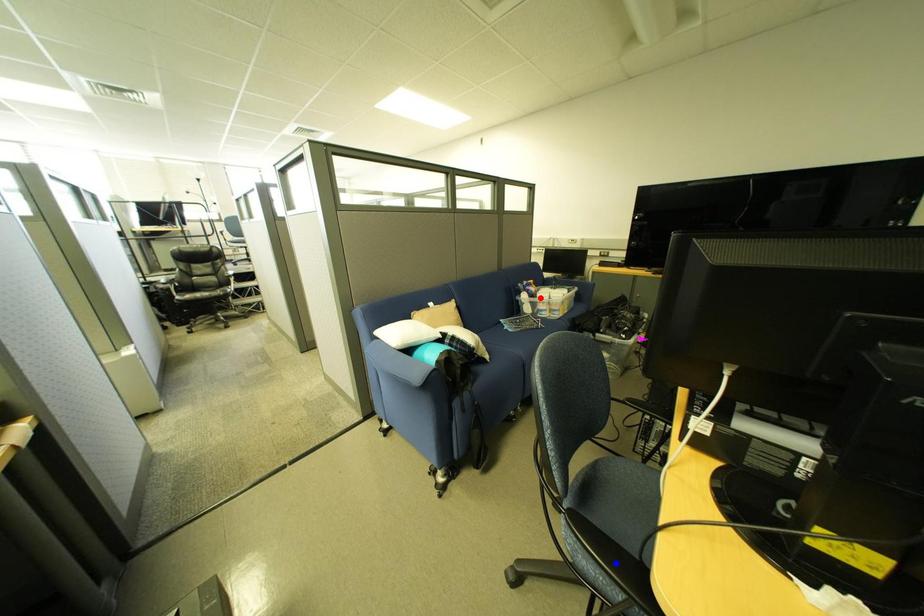
Question: In the image, two points are highlighted. Which point is nearer to the camera? Reply with the corresponding letter.

Choices:
 (A) blue point
 (B) red point

Answer: (A)